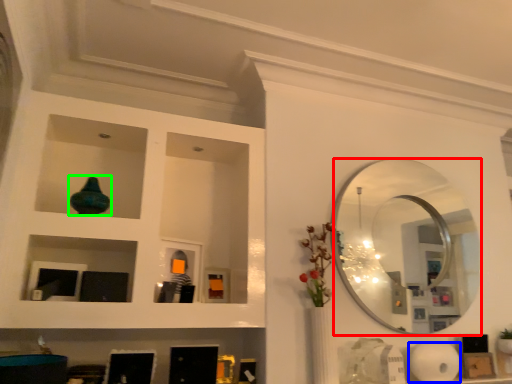
Question: Which object is the farthest from mirror (highlighted by a red box)? Choose among these: paper towel (highlighted by a blue box) or glass vase (highlighted by a green box).

Choices:
 (A) paper towel
 (B) glass vase

Answer: (B)